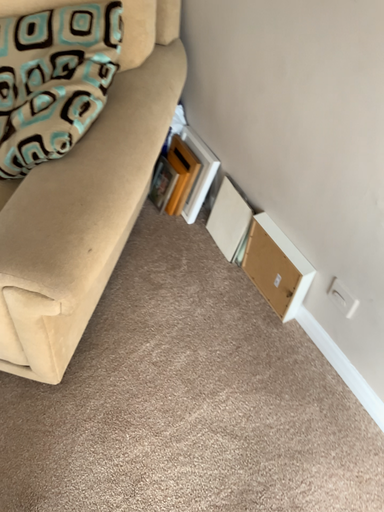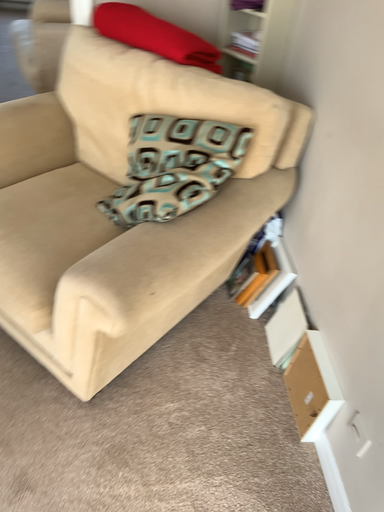
Question: How did the camera likely rotate when shooting the video?

Choices:
 (A) rotated left
 (B) rotated right

Answer: (A)